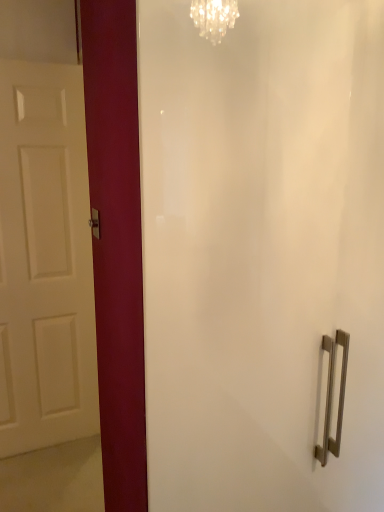
Question: Is satin nickel door handle at center-left taller or shorter than white matte door at left?

Choices:
 (A) short
 (B) tall

Answer: (A)

Question: Which is correct: satin nickel door handle at center-left is inside white matte door at left, or outside of it?

Choices:
 (A) outside
 (B) inside

Answer: (A)

Question: From the image's perspective, is satin nickel door handle at center-left above or below white matte door at left?

Choices:
 (A) below
 (B) above

Answer: (A)

Question: Looking at their shapes, would you say white matte door at left is wider or thinner than satin nickel door handle at center-left?

Choices:
 (A) wide
 (B) thin

Answer: (A)

Question: In terms of size, does white matte door at left appear bigger or smaller than satin nickel door handle at center-left?

Choices:
 (A) small
 (B) big

Answer: (B)

Question: From the image's perspective, is white matte door at left positioned above or below satin nickel door handle at center-left?

Choices:
 (A) above
 (B) below

Answer: (A)

Question: In the image, is white matte door at left positioned in front of or behind satin nickel door handle at center-left?

Choices:
 (A) front
 (B) behind

Answer: (B)